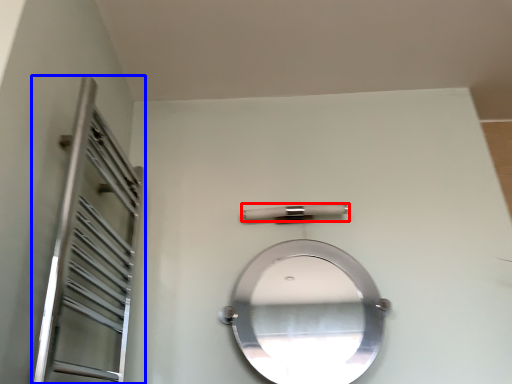
Question: Which object is closer to the camera taking this photo, door handle (highlighted by a red box) or screen door (highlighted by a blue box)?

Choices:
 (A) door handle
 (B) screen door

Answer: (B)